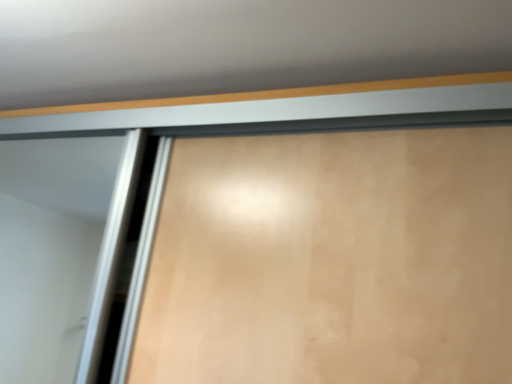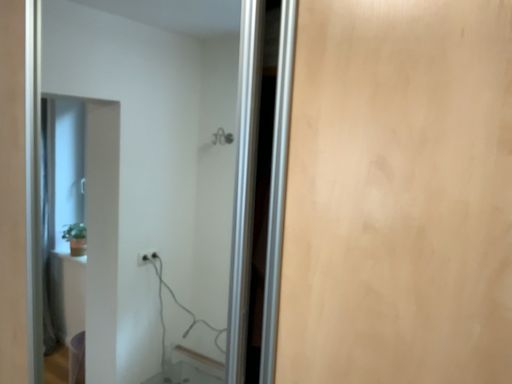
Question: Which way did the camera rotate in the video?

Choices:
 (A) rotated downward
 (B) rotated upward

Answer: (A)